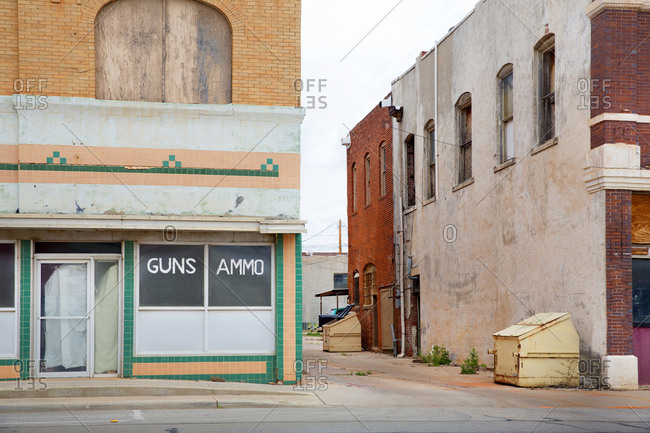
Where is `green brick trim`? The width and height of the screenshot is (650, 433). green brick trim is located at coordinates (6, 362), (23, 280), (123, 293), (164, 359), (201, 379), (279, 317), (296, 316), (78, 168).